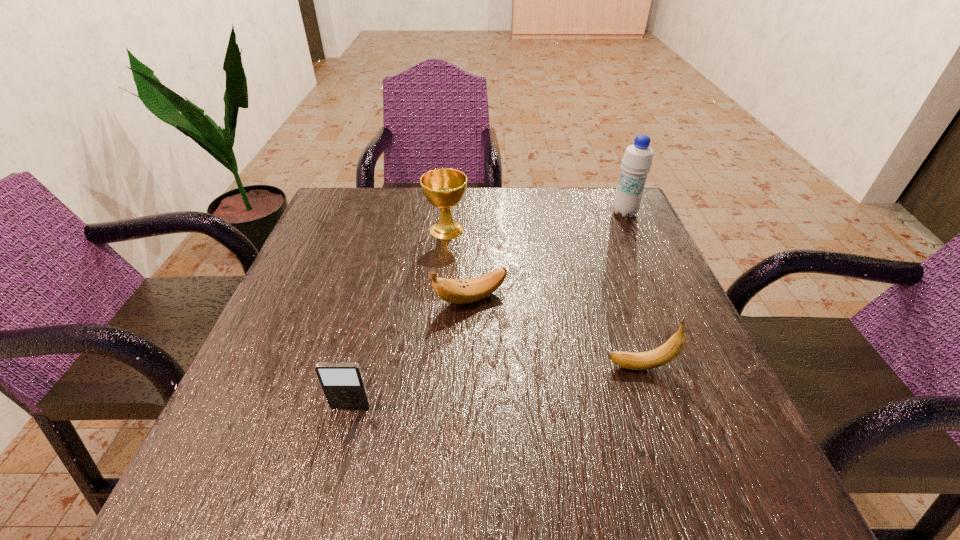
Identify the location of free spot located 0.400m at the start of the peel on the taller banana. (374, 367).

Find the location of `free space located 0.220m at the start of the peel on the taller banana`. free space located 0.220m at the start of the peel on the taller banana is located at coordinates (478, 367).

Where is `vacant space situated 0.070m at the start of the peel on the taller banana`? The image size is (960, 540). vacant space situated 0.070m at the start of the peel on the taller banana is located at coordinates (565, 367).

This screenshot has width=960, height=540. What are the coordinates of `free space located 0.080m on the front-facing side of the nearest object` in the screenshot? It's located at (337, 458).

Locate an element on the screen. vacant position located 0.260m on the right of the shorter banana is located at coordinates (636, 299).

Locate an element on the screen. The width and height of the screenshot is (960, 540). water bottle that is at the far edge is located at coordinates (637, 161).

At what (x,y) coordinates should I click in order to perform the action: click on chalice that is positioned at the far edge. Please return your answer as a coordinate pair (x, y). Looking at the image, I should click on (444, 188).

You are a GUI agent. You are given a task and a screenshot of the screen. Output one action in this format:
    pyautogui.click(x=<x>, y=<y>)
    Task: Click on the object present at the left edge
    The image size is (960, 540).
    Given the screenshot: What is the action you would take?
    pyautogui.click(x=343, y=385)

The height and width of the screenshot is (540, 960). Find the location of `water bottle that is positioned at the right edge`. water bottle that is positioned at the right edge is located at coordinates (637, 161).

Where is `banana at the right edge`? Image resolution: width=960 pixels, height=540 pixels. banana at the right edge is located at coordinates (664, 354).